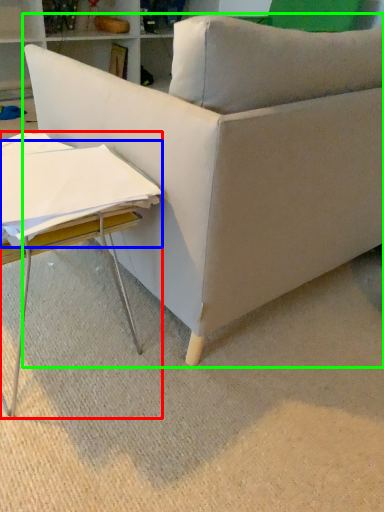
Question: Estimate the real-world distances between objects in this image. Which object is closer to table (highlighted by a red box), sheet (highlighted by a blue box) or studio couch (highlighted by a green box)?

Choices:
 (A) sheet
 (B) studio couch

Answer: (A)